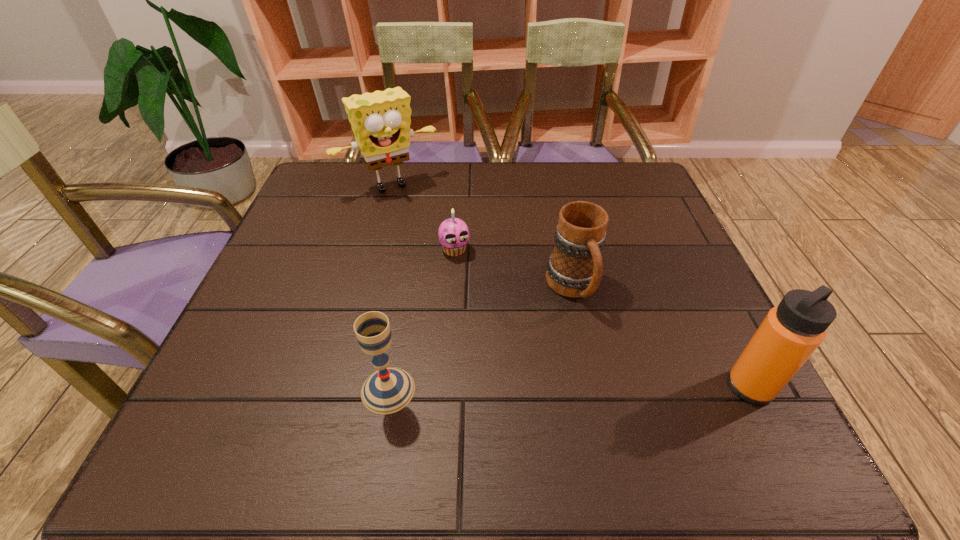
Where is `free spot at the far right corner of the desktop`? The width and height of the screenshot is (960, 540). free spot at the far right corner of the desktop is located at coordinates (620, 190).

Locate an element on the screen. Image resolution: width=960 pixels, height=540 pixels. free point between the fourth object from left to right and the cupcake is located at coordinates (514, 269).

Where is `vacant area that lies between the thermos bottle and the second object from right to left`? This screenshot has width=960, height=540. vacant area that lies between the thermos bottle and the second object from right to left is located at coordinates (661, 337).

At what (x,y) coordinates should I click in order to perform the action: click on unoccupied position between the sponge and the chalice. Please return your answer as a coordinate pair (x, y). This screenshot has width=960, height=540. Looking at the image, I should click on (389, 288).

This screenshot has height=540, width=960. What are the coordinates of `empty space between the shortest object and the sponge` in the screenshot? It's located at (422, 218).

Locate an element on the screen. Image resolution: width=960 pixels, height=540 pixels. free space between the chalice and the third nearest object is located at coordinates (481, 339).

This screenshot has height=540, width=960. Identify the location of free space that is in between the second farthest object and the thermos bottle. (603, 318).

Image resolution: width=960 pixels, height=540 pixels. I want to click on vacant area between the second farthest object and the fourth object from left to right, so click(514, 269).

The height and width of the screenshot is (540, 960). Identify the location of free space between the rightmost object and the mug. (661, 337).

Locate an element on the screen. Image resolution: width=960 pixels, height=540 pixels. free area in between the sponge and the chalice is located at coordinates (389, 288).